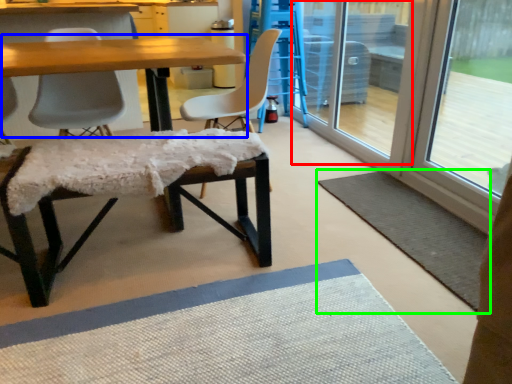
Question: Which is nearer to the screen door (highlighted by a red box)? table (highlighted by a blue box) or yoga mat (highlighted by a green box).

Choices:
 (A) table
 (B) yoga mat

Answer: (B)